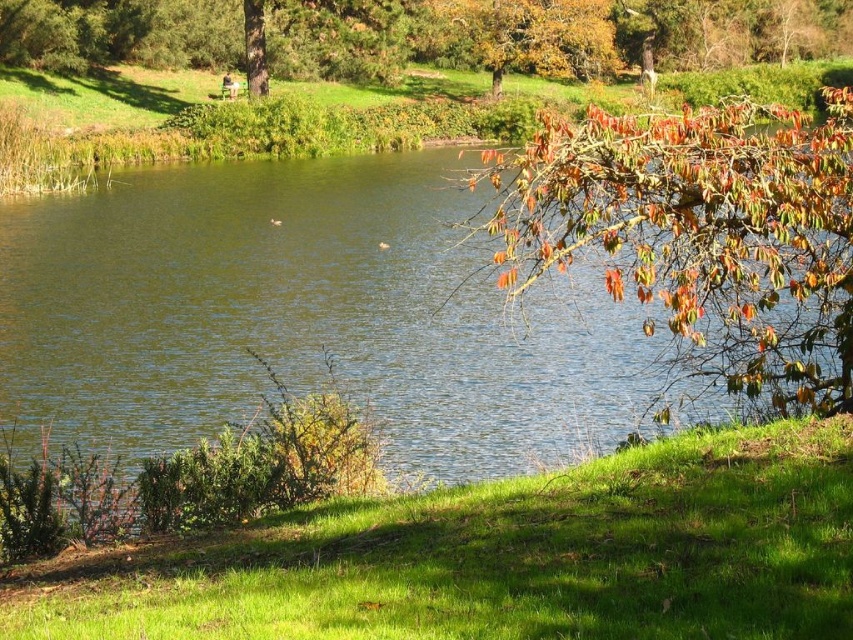
Question: Estimate the real-world distances between objects in this image. Which object is farther from the autumn leaves at upper right?

Choices:
 (A) brown leafy tree at upper center
 (B) green reflective water at center
 (C) wooden park bench at upper center
 (D) green grassy at lower left

Answer: (C)

Question: Does green grassy at lower left have a larger size compared to brown leafy tree at upper center?

Choices:
 (A) no
 (B) yes

Answer: (A)

Question: Among these objects, which one is farthest from the camera?

Choices:
 (A) green grassy at lower left
 (B) autumn leaves at upper right
 (C) green reflective water at center
 (D) wooden park bench at upper center

Answer: (D)

Question: Is green reflective water at center behind green grassy at lower left?

Choices:
 (A) no
 (B) yes

Answer: (B)

Question: Does green reflective water at center appear on the left side of wooden park bench at upper center?

Choices:
 (A) no
 (B) yes

Answer: (A)

Question: Which point appears farthest from the camera in this image?

Choices:
 (A) (630, 280)
 (B) (653, 480)
 (C) (560, 422)

Answer: (C)